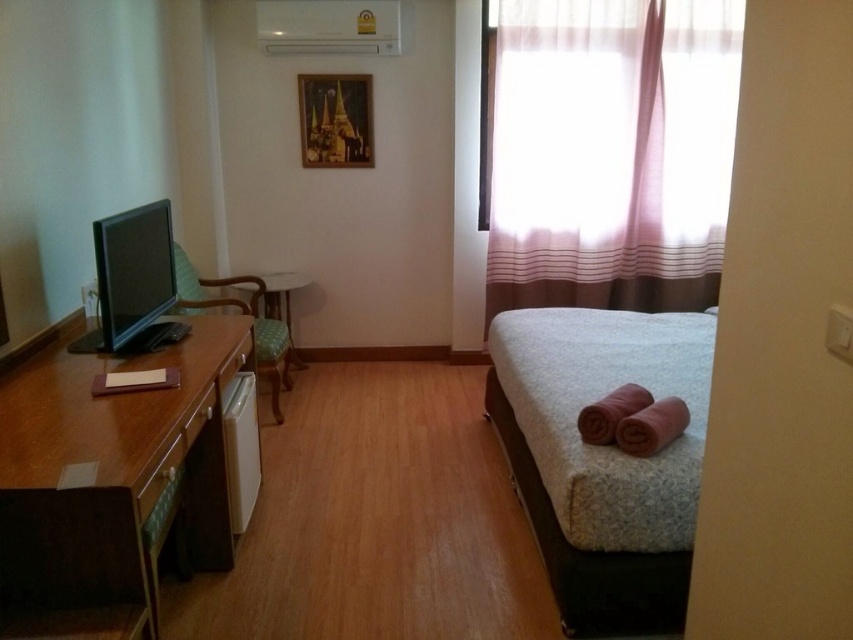
You are a guest in this room and want to hang a small picture frame on the wall. The frame is 15 cm wide. Which object between the sheer pink fabric at upper right and the white textured bed at right would you choose to place it near, considering their sizes?

The sheer pink fabric at upper right has a smaller size compared to the white textured bed at right, so the frame would fit better near the sheer pink fabric at upper right.